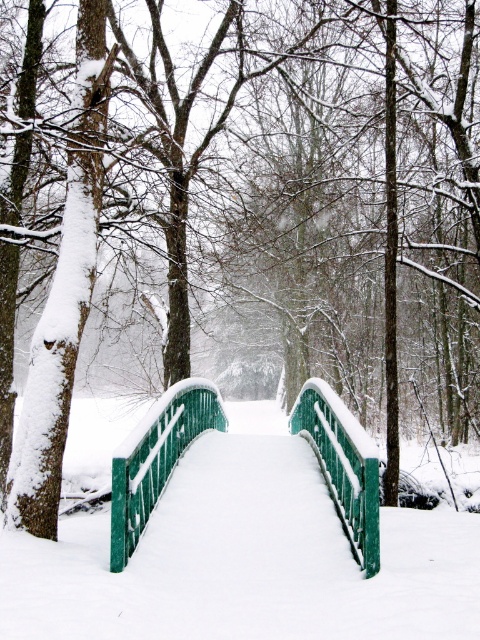
You are standing at the origin point of the winter scene. The green painted wood bridge at center is located at coordinates specified. Can you walk directly to the bridge without crossing any obstacles?

The green painted wood bridge at center is positioned at coordinates point [244,557], so yes, you can walk directly to the bridge without crossing any obstacles as there are no mentioned obstacles in the scene description.

You are standing at the origin point in the winter scene. The green matte bridge at center is located at coordinates given in the description. If you want to reach the bridge, in which general direction should you move from your current position?

The green matte bridge at center is located at coordinates point (156, 458), so you should move towards the right and slightly downward from your current position at the origin point to reach it.

You are standing in the winter scene and want to cross the green painted wood bridge at center. As you approach, you notice the green painted wood rail at center. Which object will you encounter first?

The green painted wood bridge at center is closer to the viewer than the green painted wood rail at center, so you will encounter the green painted wood bridge at center first.